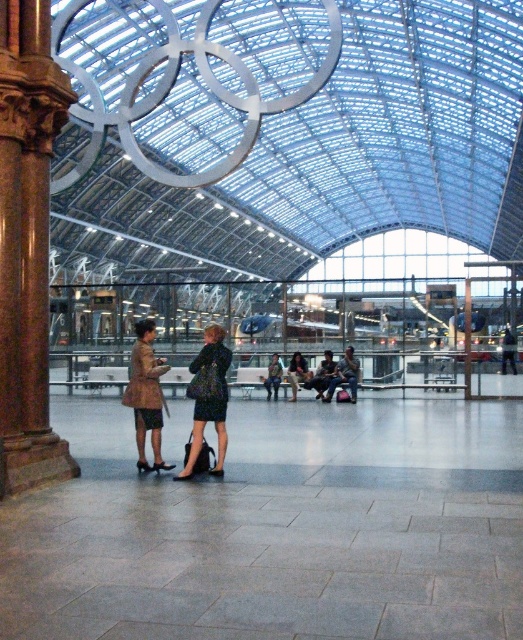
You are standing at the entrance of the train station and see two points marked in the image. The first point is at coordinates point (37,193) and the second is at point (358,369). Which point is closer to you?

Point (37,193) is closer to the camera than point (358,369), so the first point is closer to you.

You are a visitor standing at the entrance of the train station. You see the brown stone column at left and the dark blue fabric coat at center. Which object is nearer to you?

The brown stone column at left is closer to the viewer than the dark blue fabric coat at center, so the brown stone column at left is nearer to you.

You are a maintenance worker needing to move a 2.5 meter long ladder from the brown stone column at left to the dark blue fabric coat at center. Can you move the ladder horizontally without tilting it?

The distance between the brown stone column at left and the dark blue fabric coat at center is 3.02 meters. Since the ladder is 2.5 meters long, it can be moved horizontally without tilting as the distance is greater than the ladder length.